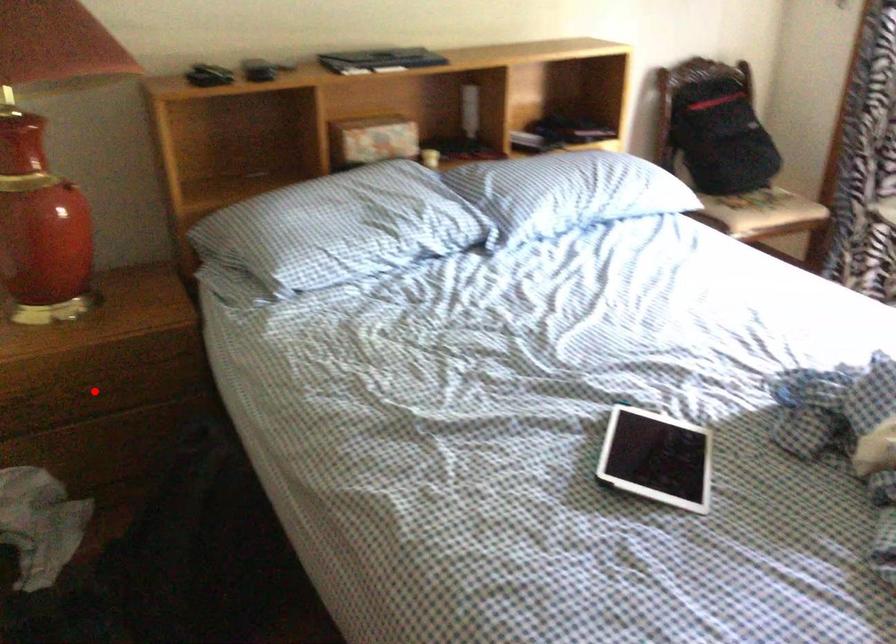
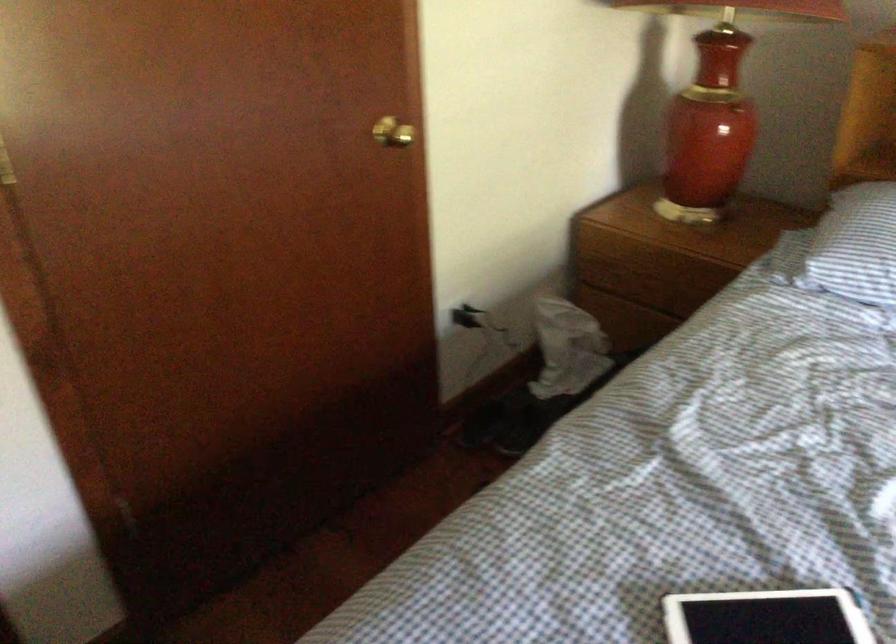
Question: A red point is marked in image1. In image2, is the corresponding 3D point closer to the camera or farther? Reply with the corresponding letter.

Choices:
 (A) The corresponding 3D point is closer.
 (B) The corresponding 3D point is farther.

Answer: (B)